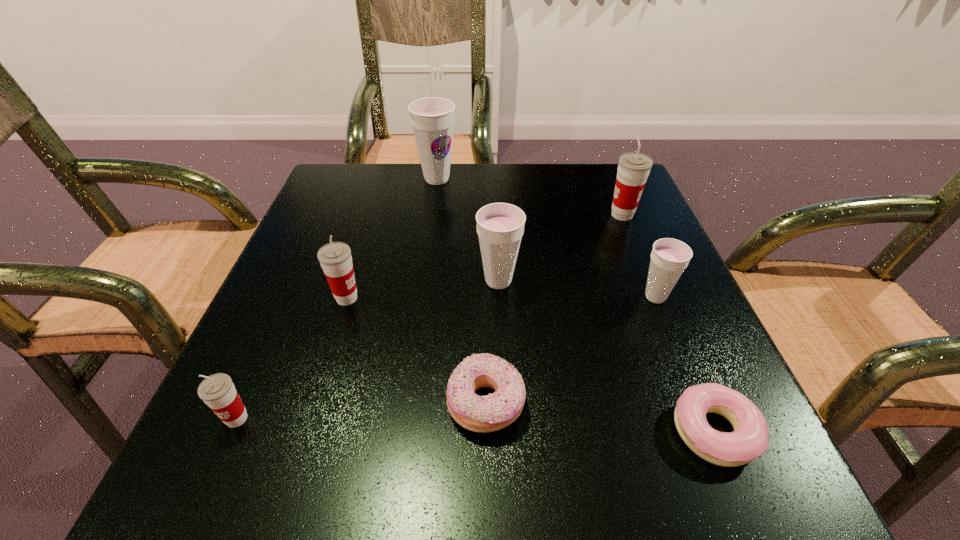
In the image, there is a desktop. Identify the location of vacant space at the far edge. The height and width of the screenshot is (540, 960). (430, 205).

Where is `free region at the near edge of the desktop`? The height and width of the screenshot is (540, 960). free region at the near edge of the desktop is located at coordinates (371, 456).

Identify the location of free space at the left edge. (293, 387).

In the image, there is a desktop. Where is `vacant region at the right edge`? The image size is (960, 540). vacant region at the right edge is located at coordinates (595, 276).

I want to click on blank space at the far left corner, so point(373,204).

In order to click on vacant space at the near left corner of the desktop in this screenshot , I will do (x=185, y=495).

I want to click on vacant space at the far right corner of the desktop, so click(587, 191).

At what (x,y) coordinates should I click in order to perform the action: click on vacant space that is in between the sixth object from right to left and the smallest purple cup. Please return your answer as a coordinate pair (x, y). The image size is (960, 540). Looking at the image, I should click on (546, 238).

This screenshot has height=540, width=960. I want to click on vacant area that lies between the taller doughnut and the shorter doughnut, so click(x=600, y=417).

Find the location of a particular element. This screenshot has width=960, height=540. unoccupied position between the left doughnut and the farthest red cup is located at coordinates (554, 309).